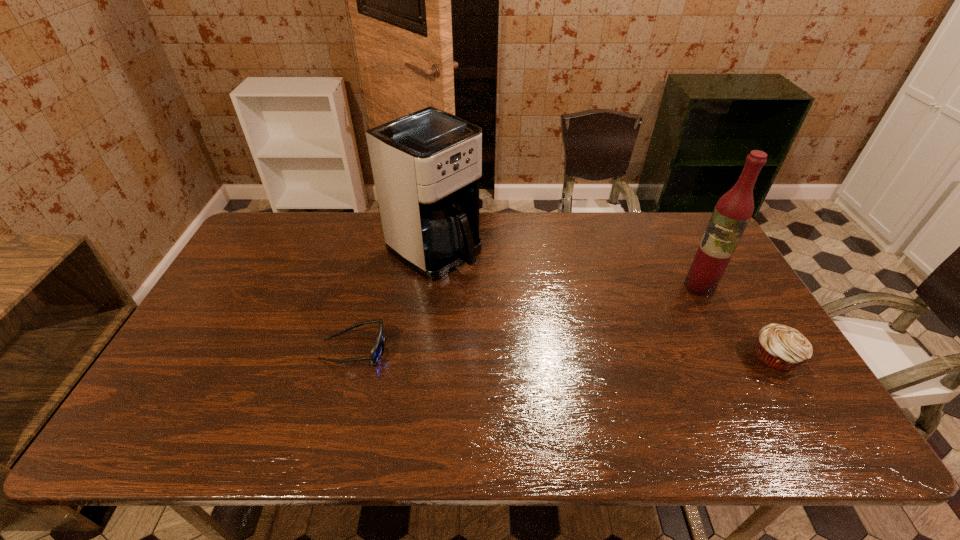
In the image, there is a desktop. Where is `vacant space at the right edge`? This screenshot has width=960, height=540. vacant space at the right edge is located at coordinates (700, 302).

This screenshot has width=960, height=540. In the image, there is a desktop. What are the coordinates of `vacant area at the far right corner` in the screenshot? It's located at (660, 222).

Locate an element on the screen. This screenshot has width=960, height=540. free space between the third tallest object and the shortest object is located at coordinates (564, 353).

I want to click on free space between the coffee maker and the sunglasses, so click(x=395, y=299).

Where is `vacant point located between the coffee maker and the liquor`? The height and width of the screenshot is (540, 960). vacant point located between the coffee maker and the liquor is located at coordinates (567, 267).

Find the location of a particular element. free space that is in between the muffin and the coffee maker is located at coordinates (605, 303).

Image resolution: width=960 pixels, height=540 pixels. What are the coordinates of `free space that is in between the liquor and the sunglasses` in the screenshot? It's located at (527, 318).

The width and height of the screenshot is (960, 540). I want to click on free space between the sunglasses and the liquor, so click(x=527, y=318).

This screenshot has height=540, width=960. Identify the location of vacant point located between the muffin and the coffee maker. (605, 303).

Locate an element on the screen. blank region between the liquor and the coffee maker is located at coordinates (567, 267).